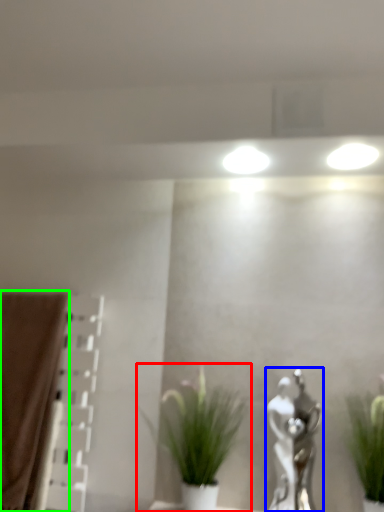
Question: Which object is positioned closest to houseplant (highlighted by a red box)? Select from art (highlighted by a blue box) and curtain (highlighted by a green box).

Choices:
 (A) art
 (B) curtain

Answer: (A)